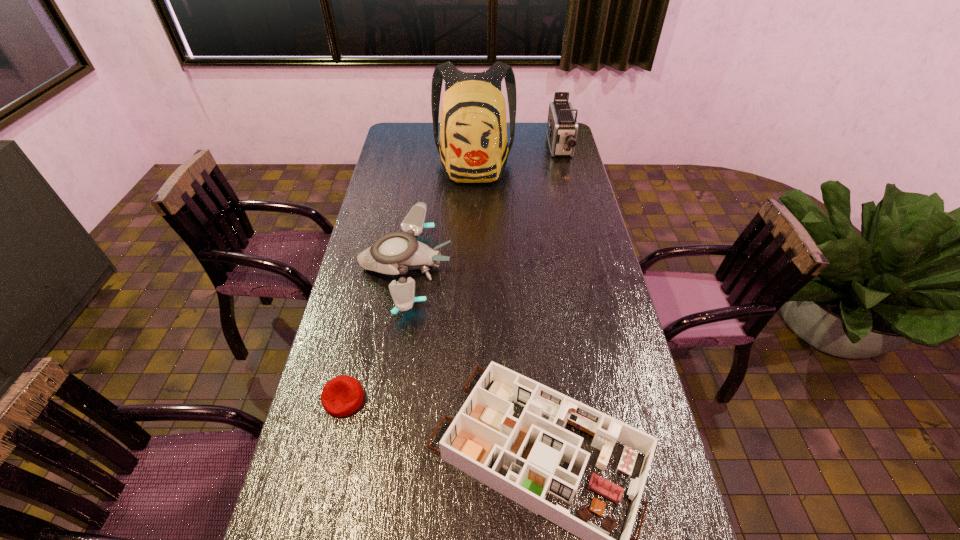
You are a GUI agent. You are given a task and a screenshot of the screen. Output one action in this format:
    pyautogui.click(x=<x>, y=<y>)
    Task: Click on the drone positioned at the left edge
    Image resolution: width=960 pixels, height=540 pixels.
    Given the screenshot: What is the action you would take?
    pyautogui.click(x=394, y=253)

Find the location of a particular element. This screenshot has width=960, height=540. beanbag positioned at the left edge is located at coordinates (341, 396).

The image size is (960, 540). In order to click on object present at the right edge in this screenshot , I will do [x=562, y=127].

At what (x,y) coordinates should I click in order to perform the action: click on object situated at the far right corner. Please return your answer as a coordinate pair (x, y). This screenshot has height=540, width=960. Looking at the image, I should click on (562, 127).

Identify the location of free space at the left edge. (420, 150).

Identify the location of vacant space at the right edge of the desktop. (567, 259).

Locate an element on the screen. The height and width of the screenshot is (540, 960). vacant space that is in between the shortest object and the camcorder is located at coordinates (451, 273).

Where is `vacant area that lies between the backpack and the camcorder`? vacant area that lies between the backpack and the camcorder is located at coordinates (516, 157).

Find the location of a particular element. The image size is (960, 540). blank region between the third farthest object and the shortest object is located at coordinates (374, 333).

Identify the location of free space between the drone and the shortest object. (374, 333).